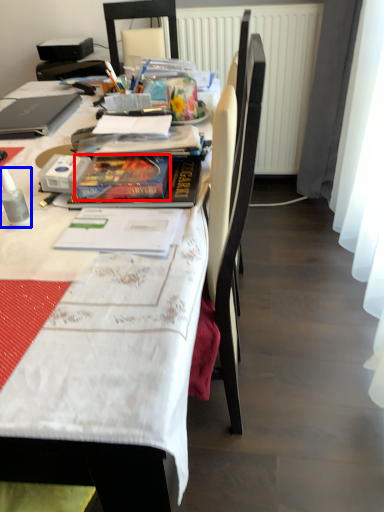
Question: Which object appears closest to the camera in this image, paperback book (highlighted by a red box) or bottle (highlighted by a blue box)?

Choices:
 (A) paperback book
 (B) bottle

Answer: (B)